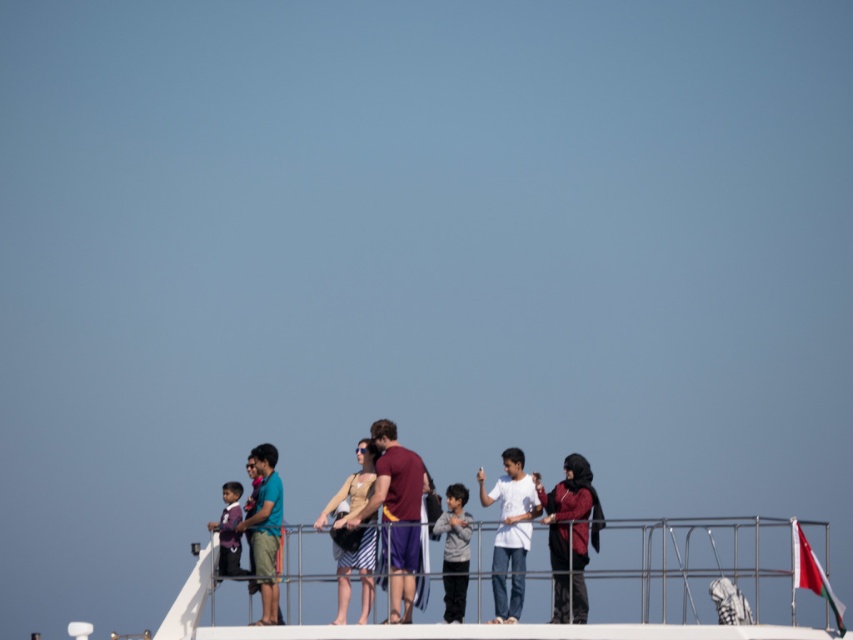
You are a photographer trying to capture a photo of the matte purple shirt at center without the red fabric flag at right blocking it. Based on the scene description, can you position yourself in a way to avoid the flag blocking the shirt?

The red fabric flag at right is in front of the matte purple shirt at center, so you would need to move to a position where the flag is no longer between you and the shirt. This could involve moving to the left side of the flag or behind it to ensure the matte purple shirt at center is visible without obstruction.

You are a photographer on a boat deck. You want to take a photo of the red fabric flag at right and the matte purple shirt at center so that both are in the frame. Given that your camera has a maximum focal length that allows capturing objects up to 100 feet apart in the same shot, will you be able to include both in a single photo?

The red fabric flag at right and matte purple shirt at center are 112.99 feet apart, which exceeds the camera maximum focal length of 100 feet. Therefore, you cannot include both in a single photo.

You are a photographer on the boat deck and want to capture both the white matte shirt at center and the striped fabric dress at center in a single shot. Which one is positioned lower in the frame?

The white matte shirt at center is located below the striped fabric dress at center, so it is positioned lower in the frame.